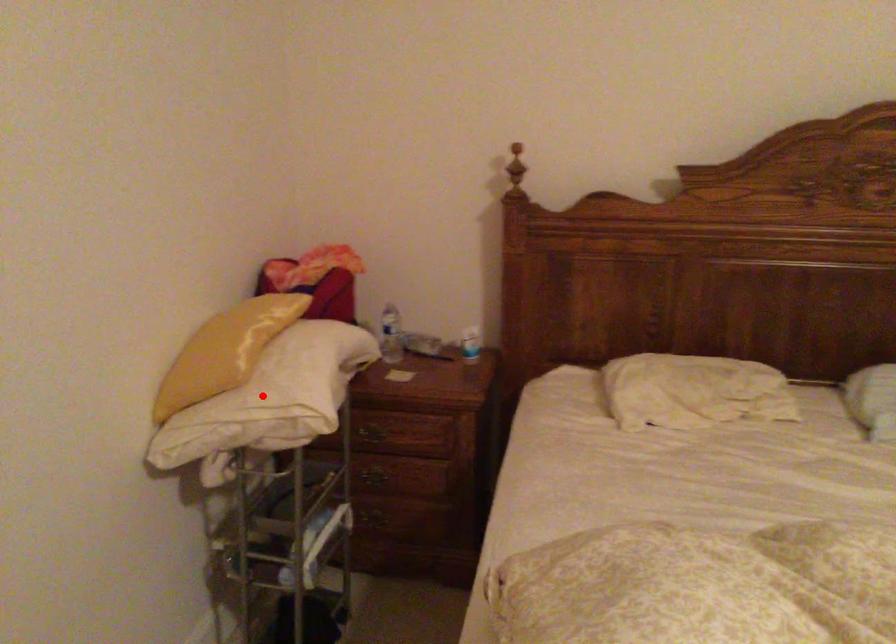
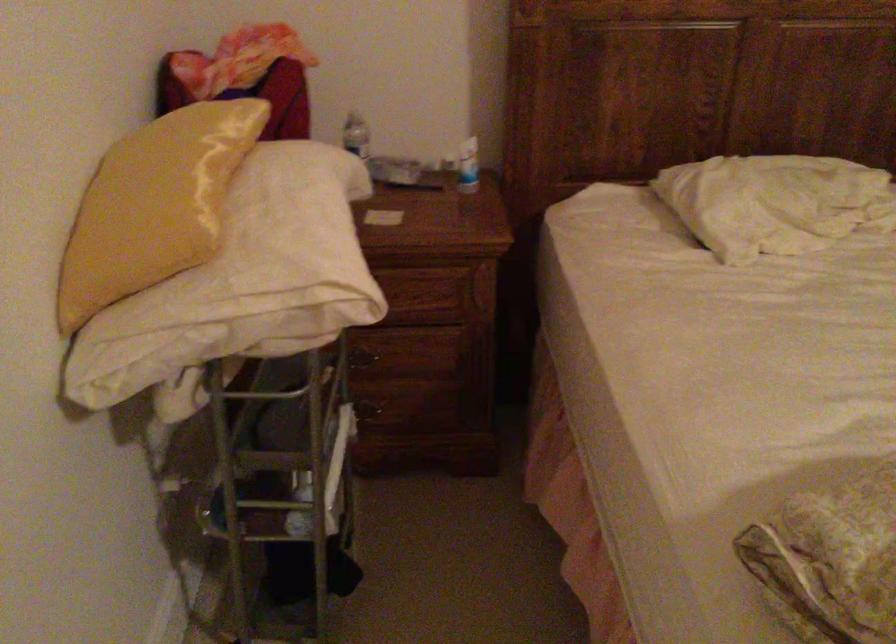
Question: A red point is marked in image1. In image2, is the corresponding 3D point closer to the camera or farther? Reply with the corresponding letter.

Choices:
 (A) The corresponding 3D point is closer.
 (B) The corresponding 3D point is farther.

Answer: (A)